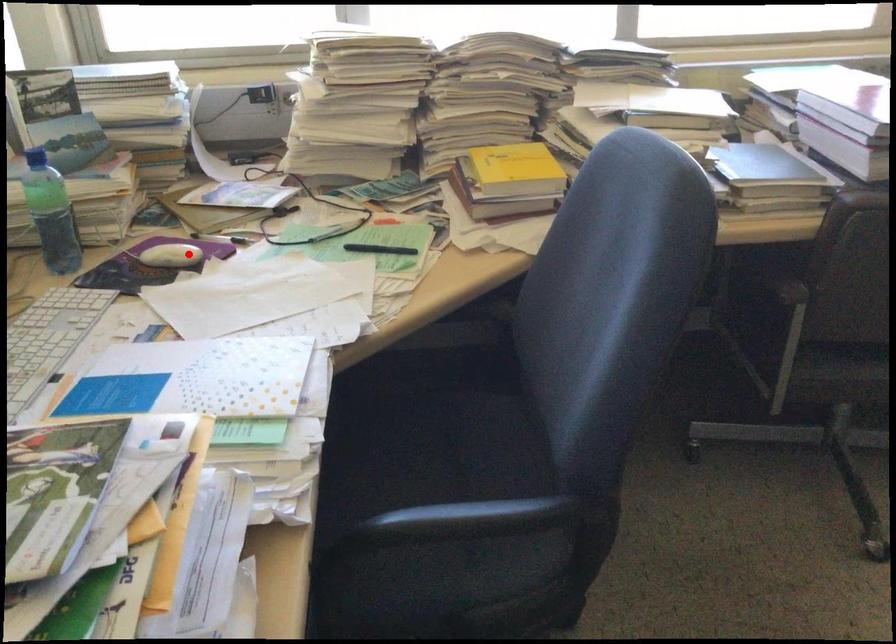
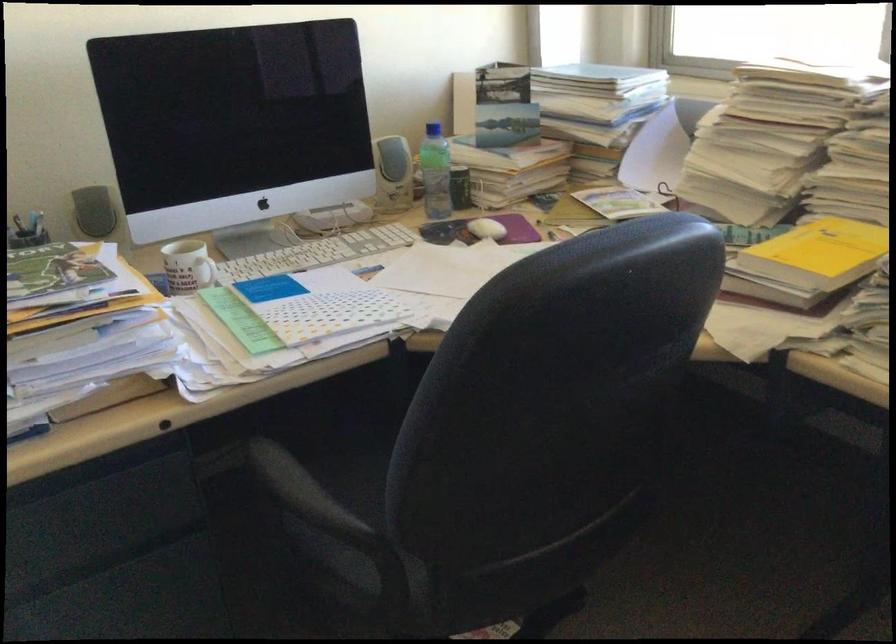
Question: I am providing you with two images of the same scene from different viewpoints. In image1, a red point is highlighted. Considering the same 3D point in image2, which of the following is correct?

Choices:
 (A) It is closer
 (B) It is farther

Answer: (B)